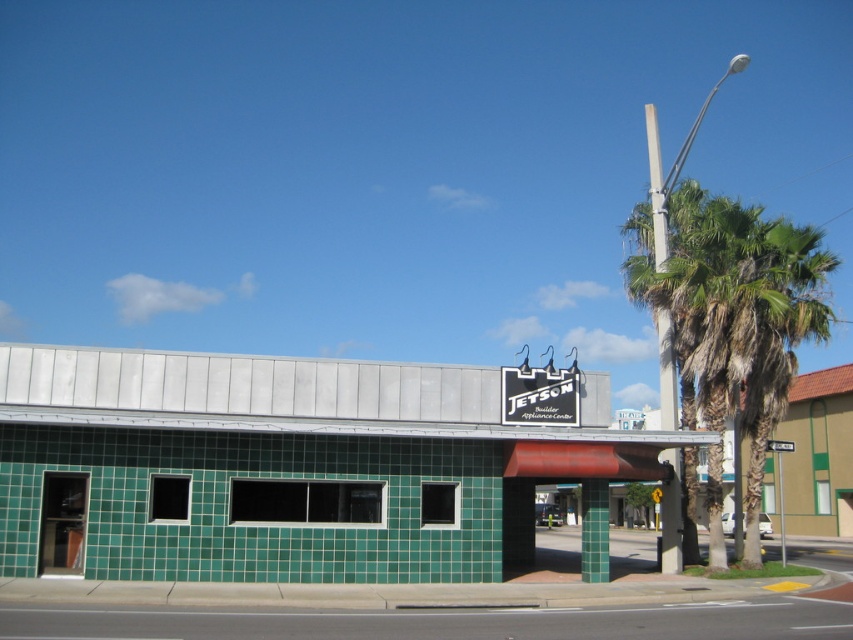
Question: Is green leafy palm tree at upper right bigger than black plastic sign at center?

Choices:
 (A) yes
 (B) no

Answer: (A)

Question: From the image, what is the correct spatial relationship of green leafy palm tree at upper right in relation to black plastic sign at center?

Choices:
 (A) below
 (B) above

Answer: (B)

Question: Which of these objects is positioned closest to the black plastic sign at upper center?

Choices:
 (A) black plastic sign at center
 (B) green leafy palm tree at upper right

Answer: (A)

Question: Which object is positioned farthest from the black plastic sign at center?

Choices:
 (A) green leafy palm tree at upper right
 (B) black plastic sign at upper center

Answer: (A)

Question: Is black plastic sign at upper center above black plastic sign at center?

Choices:
 (A) no
 (B) yes

Answer: (B)

Question: Which is nearer to the black plastic sign at center?

Choices:
 (A) black plastic sign at upper center
 (B) green leafy palm tree at upper right

Answer: (A)